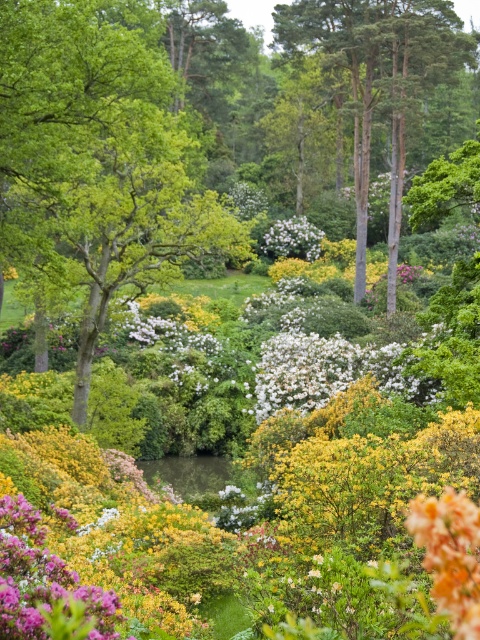
Question: Among these points, which one is nearest to the camera?

Choices:
 (A) click(383, 16)
 (B) click(308, 234)
 (C) click(433, 577)

Answer: (C)

Question: Which is farther from the white matte flower at center?

Choices:
 (A) orange textured flower at lower right
 (B) smooth bark tree at upper center

Answer: (A)

Question: Does smooth bark tree at upper center have a larger size compared to purple matte flower at center?

Choices:
 (A) yes
 (B) no

Answer: (A)

Question: Considering the relative positions of purple matte flower at center and orange textured flower at lower right in the image provided, where is purple matte flower at center located with respect to orange textured flower at lower right?

Choices:
 (A) left
 (B) right

Answer: (A)

Question: Is purple matte flower at center wider than white matte flower at center?

Choices:
 (A) yes
 (B) no

Answer: (A)

Question: Among these objects, which one is farthest from the camera?

Choices:
 (A) purple matte flower at center
 (B) smooth bark tree at upper center

Answer: (B)